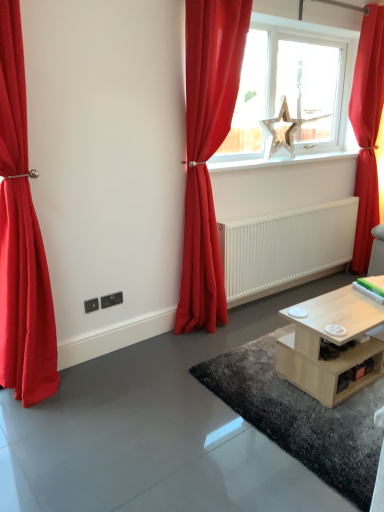
You are a GUI agent. You are given a task and a screenshot of the screen. Output one action in this format:
    pyautogui.click(x=<x>, y=<y>)
    Task: Click on the vacant space underneath white smooth radiator at center (from a real-world perspective)
    The height and width of the screenshot is (512, 384).
    Given the screenshot: What is the action you would take?
    pyautogui.click(x=296, y=290)